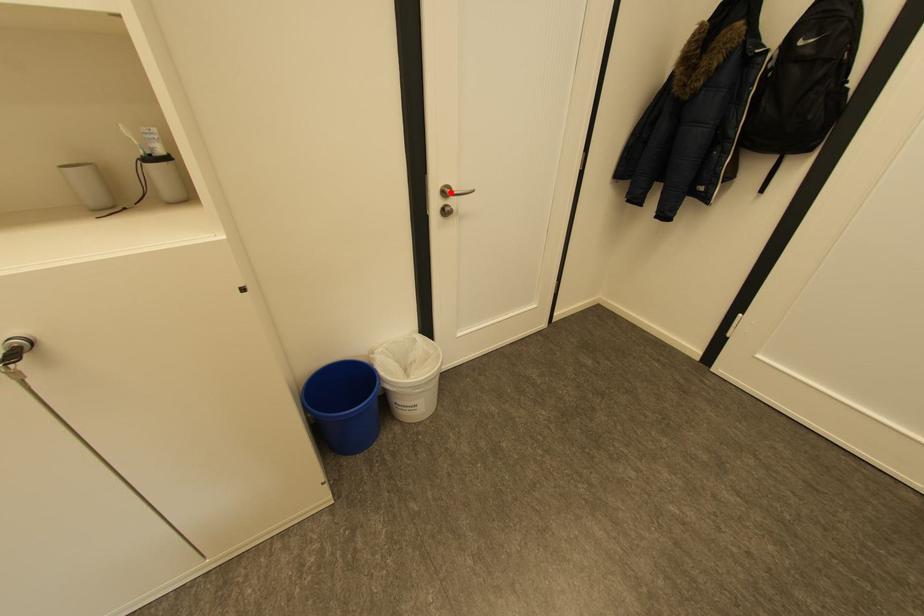
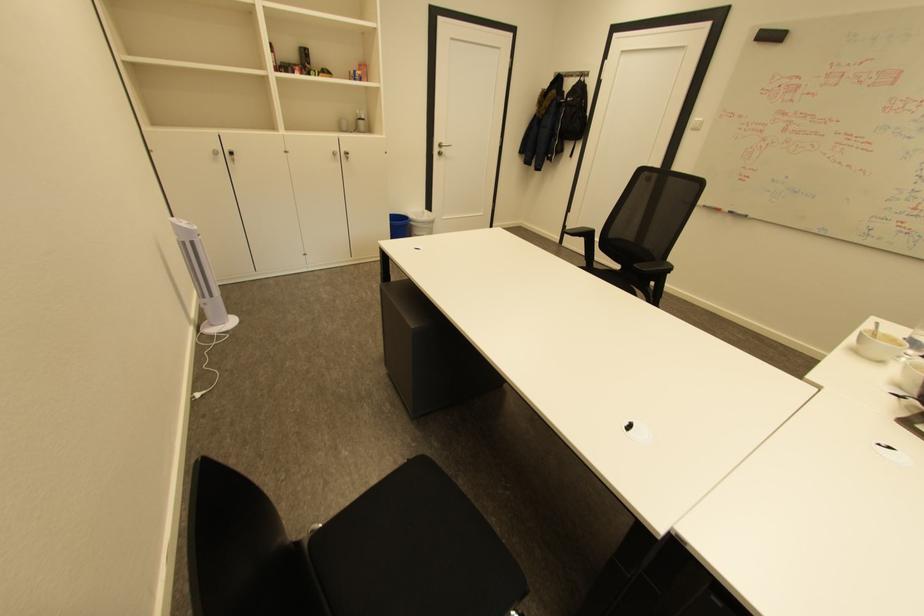
Where in the second image is the point corresponding to the highlighted location from the first image?

(446, 146)